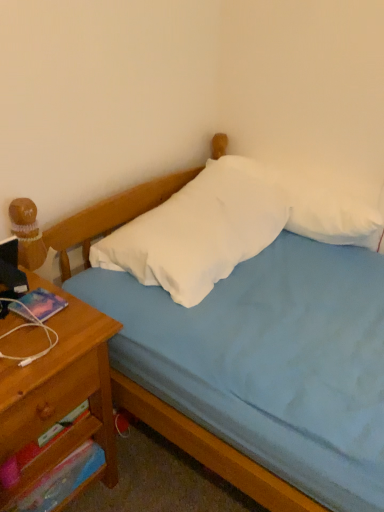
Question: From a real-world perspective, is wooden drawer at left, acting as the first drawer starting from the top, positioned over wooden nightstand at left based on gravity?

Choices:
 (A) yes
 (B) no

Answer: (A)

Question: Is wooden drawer at left, acting as the first drawer starting from the top, shorter than wooden nightstand at left?

Choices:
 (A) yes
 (B) no

Answer: (A)

Question: Can you confirm if wooden drawer at left, the second drawer when ordered from bottom to top, is taller than wooden nightstand at left?

Choices:
 (A) no
 (B) yes

Answer: (A)

Question: Considering the relative sizes of wooden drawer at left, acting as the first drawer starting from the top, and wooden nightstand at left in the image provided, is wooden drawer at left, acting as the first drawer starting from the top, bigger than wooden nightstand at left?

Choices:
 (A) yes
 (B) no

Answer: (B)

Question: Is wooden drawer at left, the second drawer when ordered from bottom to top, completely or partially outside of wooden nightstand at left?

Choices:
 (A) yes
 (B) no

Answer: (B)

Question: Is wooden drawer at left, the second drawer when ordered from bottom to top, not close to wooden nightstand at left?

Choices:
 (A) no
 (B) yes

Answer: (A)

Question: Considering the relative sizes of white soft pillow at upper right, the 1th pillow when ordered from right to left, and wooden drawer at left, the second drawer when ordered from bottom to top, in the image provided, is white soft pillow at upper right, the 1th pillow when ordered from right to left, thinner than wooden drawer at left, the second drawer when ordered from bottom to top,?

Choices:
 (A) no
 (B) yes

Answer: (B)

Question: Is white soft pillow at upper right, acting as the 2th pillow starting from the left, placed right next to wooden drawer at left, acting as the first drawer starting from the top?

Choices:
 (A) no
 (B) yes

Answer: (A)

Question: From the image's perspective, is white soft pillow at upper right, the 1th pillow when ordered from right to left, under wooden drawer at left, acting as the first drawer starting from the top?

Choices:
 (A) no
 (B) yes

Answer: (A)

Question: Can wooden drawer at left, the second drawer when ordered from bottom to top, be found inside white soft pillow at upper right, the 1th pillow when ordered from right to left?

Choices:
 (A) yes
 (B) no

Answer: (B)

Question: Are white soft pillow at upper right, the 1th pillow when ordered from right to left, and wooden drawer at left, the second drawer when ordered from bottom to top, far apart?

Choices:
 (A) no
 (B) yes

Answer: (A)

Question: Could you tell me if white soft pillow at upper right, the 1th pillow when ordered from right to left, is facing wooden drawer at left, acting as the first drawer starting from the top?

Choices:
 (A) yes
 (B) no

Answer: (B)

Question: Is wooden drawer at left, acting as the first drawer starting from the top, aimed at light blue fabric bed at center?

Choices:
 (A) yes
 (B) no

Answer: (B)